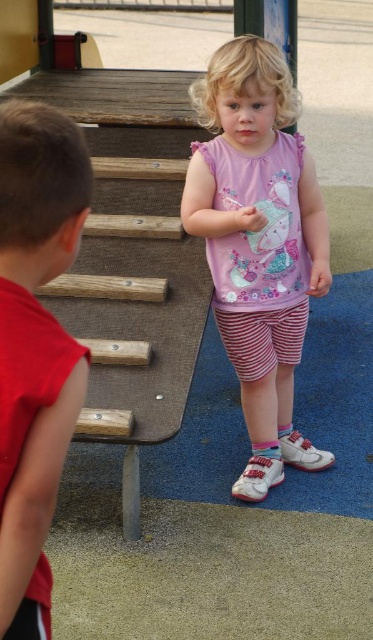
Does pink fabric shirt at center have a larger size compared to red fabric sleeveless shirt at left?

Correct, pink fabric shirt at center is larger in size than red fabric sleeveless shirt at left.

Does pink fabric shirt at center have a greater width compared to red fabric sleeveless shirt at left?

Correct, the width of pink fabric shirt at center exceeds that of red fabric sleeveless shirt at left.

Where is `pink fabric shirt at center`? pink fabric shirt at center is located at coordinates (258, 244).

You are a GUI agent. You are given a task and a screenshot of the screen. Output one action in this format:
    pyautogui.click(x=<x>, y=<y>)
    Task: Click on the pink fabric shirt at center
    
    Given the screenshot: What is the action you would take?
    pyautogui.click(x=258, y=244)